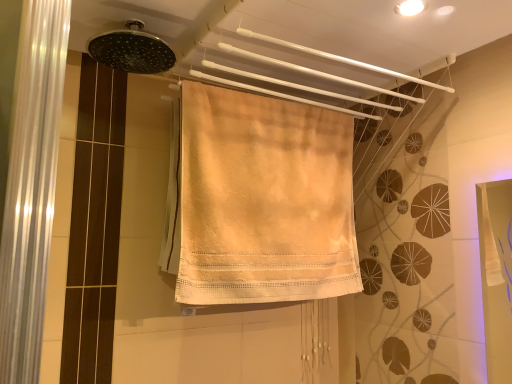
This screenshot has width=512, height=384. What do you see at coordinates (263, 200) in the screenshot?
I see `beige cotton towel at center` at bounding box center [263, 200].

Identify the location of beige cotton towel at center. (263, 200).

You are a GUI agent. You are given a task and a screenshot of the screen. Output one action in this format:
    pyautogui.click(x=<x>, y=<y>)
    Task: Click on the matte black shower head at upper center
    
    Given the screenshot: What is the action you would take?
    pyautogui.click(x=132, y=50)

Describe the element at coordinates (132, 50) in the screenshot. I see `matte black shower head at upper center` at that location.

What are the coordinates of `beige cotton towel at center` in the screenshot? It's located at (263, 200).

Does beige cotton towel at center appear on the right side of matte black shower head at upper center?

Yes.

Does beige cotton towel at center come in front of matte black shower head at upper center?

No, the depth of beige cotton towel at center is greater than that of matte black shower head at upper center.

Does point (296, 199) appear closer or farther from the camera than point (125, 51)?

Clearly, point (296, 199) is more distant from the camera than point (125, 51).

In the scene shown: From the image's perspective, would you say beige cotton towel at center is positioned over matte black shower head at upper center?

No.

Looking at this image, from a real-world perspective, is beige cotton towel at center physically below matte black shower head at upper center?

Yes, from a real-world perspective, beige cotton towel at center is below matte black shower head at upper center.

Between beige cotton towel at center and matte black shower head at upper center, which one has larger width?

matte black shower head at upper center is wider.

Does beige cotton towel at center have a greater height compared to matte black shower head at upper center?

Yes.

Looking at the image, does beige cotton towel at center seem bigger or smaller compared to matte black shower head at upper center?

beige cotton towel at center is bigger than matte black shower head at upper center.

Is beige cotton towel at center located outside matte black shower head at upper center?

Absolutely, beige cotton towel at center is external to matte black shower head at upper center.

Is beige cotton towel at center positioned far away from matte black shower head at upper center?

No, beige cotton towel at center is in close proximity to matte black shower head at upper center.

Is beige cotton towel at center positioned with its back to matte black shower head at upper center?

No, matte black shower head at upper center is not at the back of beige cotton towel at center.

The height and width of the screenshot is (384, 512). In order to click on towel that is on the right side of matte black shower head at upper center in this screenshot , I will do `click(263, 200)`.

Looking at this image, considering the positions of objects matte black shower head at upper center and beige cotton towel at center in the image provided, who is more to the right, matte black shower head at upper center or beige cotton towel at center?

beige cotton towel at center is more to the right.

From the picture: Considering the positions of objects matte black shower head at upper center and beige cotton towel at center in the image provided, who is behind, matte black shower head at upper center or beige cotton towel at center?

Positioned behind is beige cotton towel at center.

Is point (149, 59) in front of point (222, 220)?

Yes.

From the image's perspective, between matte black shower head at upper center and beige cotton towel at center, which one is located above?

matte black shower head at upper center appears higher in the image.

From a real-world perspective, between matte black shower head at upper center and beige cotton towel at center, who is vertically higher?

From a 3D spatial view, matte black shower head at upper center is above.

Considering the relative sizes of matte black shower head at upper center and beige cotton towel at center in the image provided, is matte black shower head at upper center thinner than beige cotton towel at center?

No, matte black shower head at upper center is not thinner than beige cotton towel at center.

Considering the sizes of objects matte black shower head at upper center and beige cotton towel at center in the image provided, who is taller, matte black shower head at upper center or beige cotton towel at center?

Standing taller between the two is beige cotton towel at center.

Considering the sizes of matte black shower head at upper center and beige cotton towel at center in the image, is matte black shower head at upper center bigger or smaller than beige cotton towel at center?

Clearly, matte black shower head at upper center is smaller in size than beige cotton towel at center.

Is matte black shower head at upper center not inside beige cotton towel at center?

matte black shower head at upper center is positioned outside beige cotton towel at center.

Is matte black shower head at upper center positioned far away from beige cotton towel at center?

No, matte black shower head at upper center is not far from beige cotton towel at center.

Based on the photo, is matte black shower head at upper center looking in the opposite direction of beige cotton towel at center?

That's not correct — matte black shower head at upper center is not looking away from beige cotton towel at center.

Locate an element on the screen. The image size is (512, 384). towel behind the matte black shower head at upper center is located at coordinates (263, 200).

You are a GUI agent. You are given a task and a screenshot of the screen. Output one action in this format:
    pyautogui.click(x=<x>, y=<y>)
    Task: Click on the shower above the beige cotton towel at center (from the image's perspective)
    This screenshot has width=512, height=384.
    Given the screenshot: What is the action you would take?
    pyautogui.click(x=132, y=50)

Where is `towel below the matte black shower head at upper center (from the image's perspective)`? The width and height of the screenshot is (512, 384). towel below the matte black shower head at upper center (from the image's perspective) is located at coordinates (263, 200).